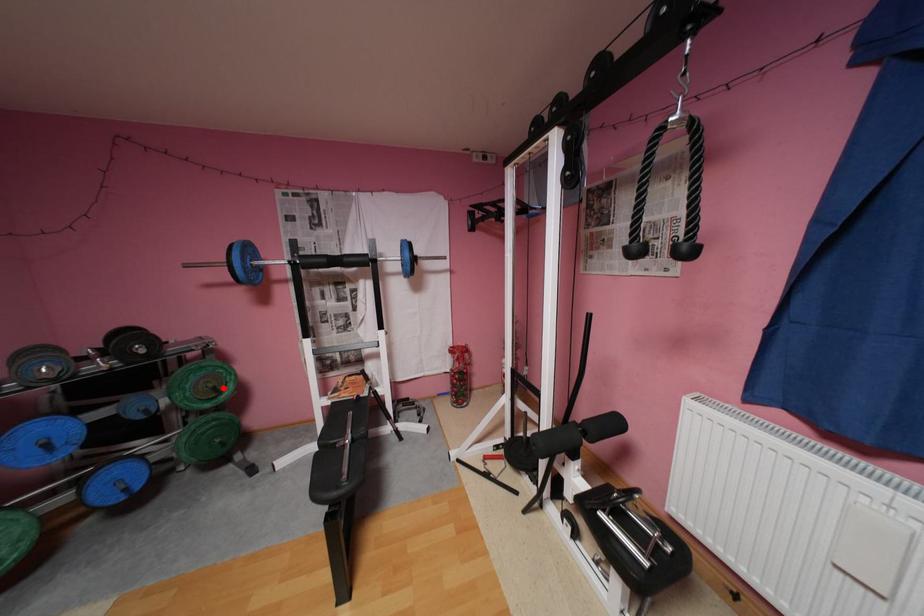
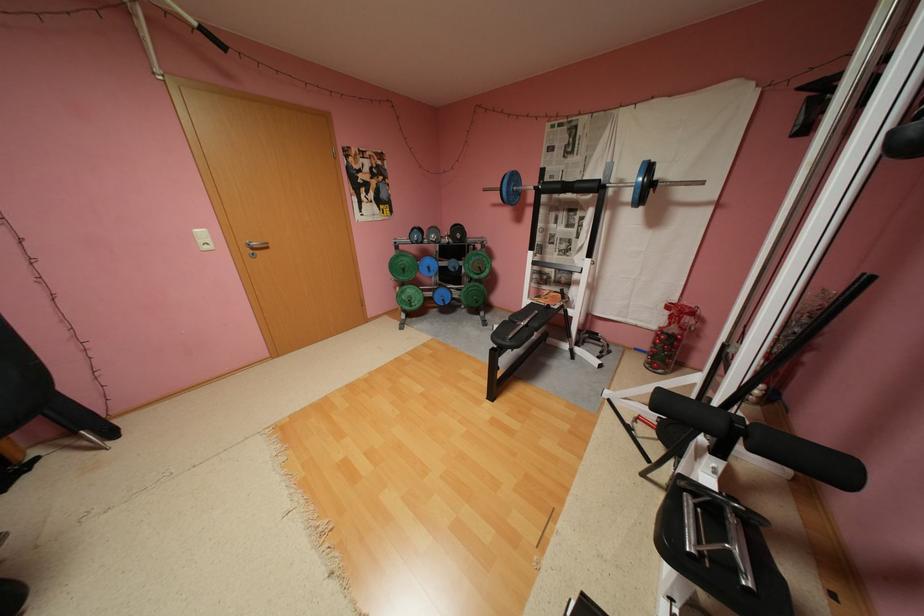
Question: I am providing you with two images of the same scene from different viewpoints. Given a red point in image1, look at the same physical point in image2. Is it:

Choices:
 (A) Closer to the viewpoint
 (B) Farther from the viewpoint

Answer: (A)